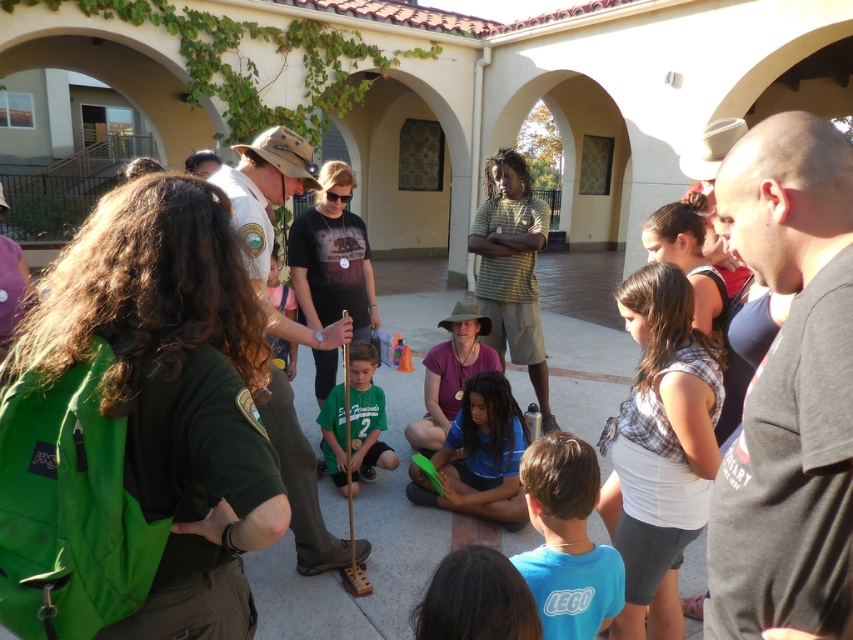
Is blue fabric at center shorter than matte purple shirt at center?

Yes, blue fabric at center is shorter than matte purple shirt at center.

The image size is (853, 640). Describe the element at coordinates (480, 456) in the screenshot. I see `blue fabric at center` at that location.

The image size is (853, 640). I want to click on blue fabric at center, so [480, 456].

Between green striped shirt at center and light brown wooden stick at center, which one appears on the right side from the viewer's perspective?

green striped shirt at center is more to the right.

At what (x,y) coordinates should I click in order to perform the action: click on green striped shirt at center. Please return your answer as a coordinate pair (x, y). This screenshot has width=853, height=640. Looking at the image, I should click on (512, 268).

Who is shorter, plaid fabric shirt at center or light brown wooden stick at center?

light brown wooden stick at center

Consider the image. Does plaid fabric shirt at center appear on the left side of light brown wooden stick at center?

Incorrect, plaid fabric shirt at center is not on the left side of light brown wooden stick at center.

In order to click on plaid fabric shirt at center in this screenshot , I will do `click(660, 448)`.

Identify the location of plaid fabric shirt at center. This screenshot has height=640, width=853. (660, 448).